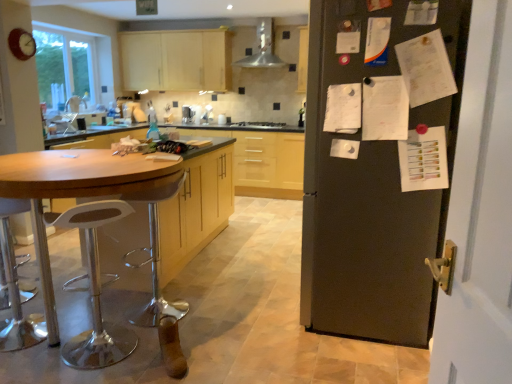
You are a GUI agent. You are given a task and a screenshot of the screen. Output one action in this format:
    pyautogui.click(x=<x>, y=<y>)
    Task: Click on the free space to the left of matte black refrigerator at right
    
    Given the screenshot: What is the action you would take?
    pyautogui.click(x=248, y=310)